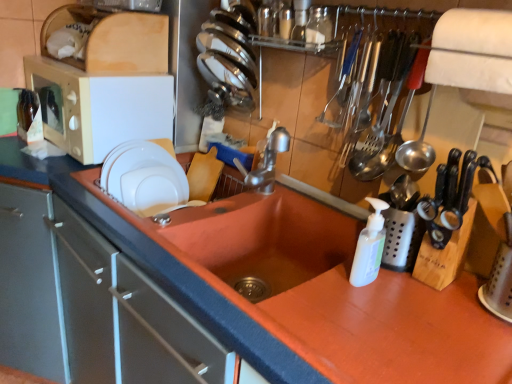
Question: Does metallic silverware at upper right turn towards shiny stainless steel plates at upper center, which is the second tableware from left to right?

Choices:
 (A) yes
 (B) no

Answer: (B)

Question: From the image's perspective, is metallic silverware at upper right above shiny stainless steel plates at upper center, acting as the 1th tableware starting from the top?

Choices:
 (A) no
 (B) yes

Answer: (A)

Question: From a real-world perspective, is metallic silverware at upper right located beneath shiny stainless steel plates at upper center, acting as the 1th tableware starting from the top?

Choices:
 (A) yes
 (B) no

Answer: (A)

Question: Are metallic silverware at upper right and shiny stainless steel plates at upper center, which is the second tableware from left to right, making contact?

Choices:
 (A) yes
 (B) no

Answer: (B)

Question: Considering the relative positions of metallic silverware at upper right and shiny stainless steel plates at upper center, positioned as the first tableware in right-to-left order, in the image provided, is metallic silverware at upper right to the right of shiny stainless steel plates at upper center, positioned as the first tableware in right-to-left order, from the viewer's perspective?

Choices:
 (A) no
 (B) yes

Answer: (B)

Question: Looking at their shapes, would you say translucent amber glass at upper left, the first bottle positioned from the bottom, is wider or thinner than metallic silverware at upper right?

Choices:
 (A) wide
 (B) thin

Answer: (A)

Question: From the image's perspective, is translucent amber glass at upper left, arranged as the second bottle when viewed from the top, located above or below metallic silverware at upper right?

Choices:
 (A) below
 (B) above

Answer: (B)

Question: Based on their sizes in the image, would you say translucent amber glass at upper left, the first bottle positioned from the bottom, is bigger or smaller than metallic silverware at upper right?

Choices:
 (A) small
 (B) big

Answer: (A)

Question: Which is correct: translucent amber glass at upper left, which is the 1th bottle in back-to-front order, is inside metallic silverware at upper right, or outside of it?

Choices:
 (A) inside
 (B) outside

Answer: (B)

Question: Based on their positions, is matte white microwave at left located to the left or right of transparent glass jar at upper center, the second bottle in the bottom-to-top sequence?

Choices:
 (A) right
 (B) left

Answer: (B)

Question: From a real-world perspective, is matte white microwave at left positioned above or below transparent glass jar at upper center, positioned as the second bottle in left-to-right order?

Choices:
 (A) above
 (B) below

Answer: (B)

Question: Considering the positions of matte white microwave at left and transparent glass jar at upper center, which is counted as the 1th bottle, starting from the top, in the image, is matte white microwave at left taller or shorter than transparent glass jar at upper center, which is counted as the 1th bottle, starting from the top,?

Choices:
 (A) tall
 (B) short

Answer: (A)

Question: From the image's perspective, is matte white microwave at left positioned above or below transparent glass jar at upper center, the 1th bottle from the front?

Choices:
 (A) below
 (B) above

Answer: (A)

Question: Is point (331, 29) closer or farther from the camera than point (166, 344)?

Choices:
 (A) farther
 (B) closer

Answer: (A)

Question: Do you think transparent glass jar at upper center, which is counted as the 1th bottle, starting from the top, is within matte white drawer at left, or outside of it?

Choices:
 (A) outside
 (B) inside

Answer: (A)